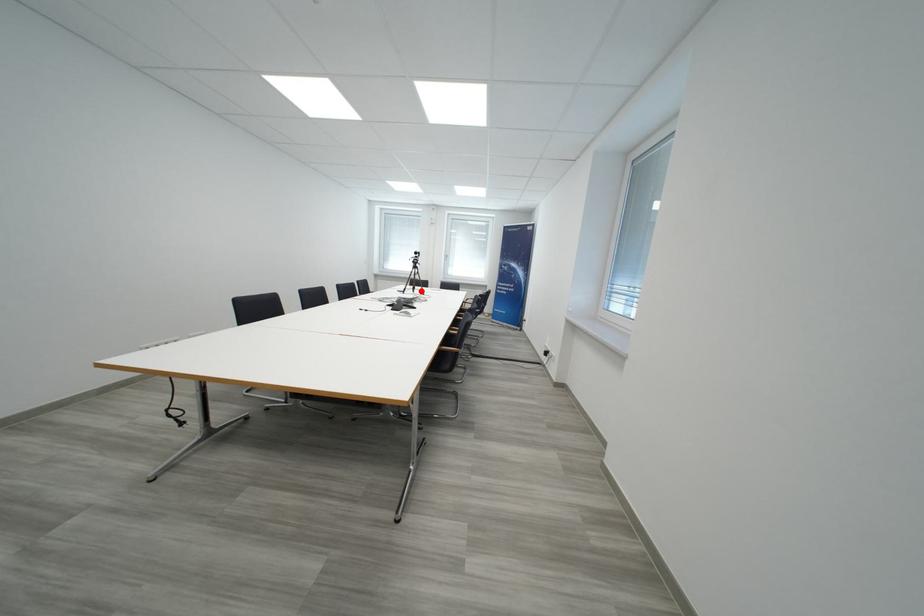
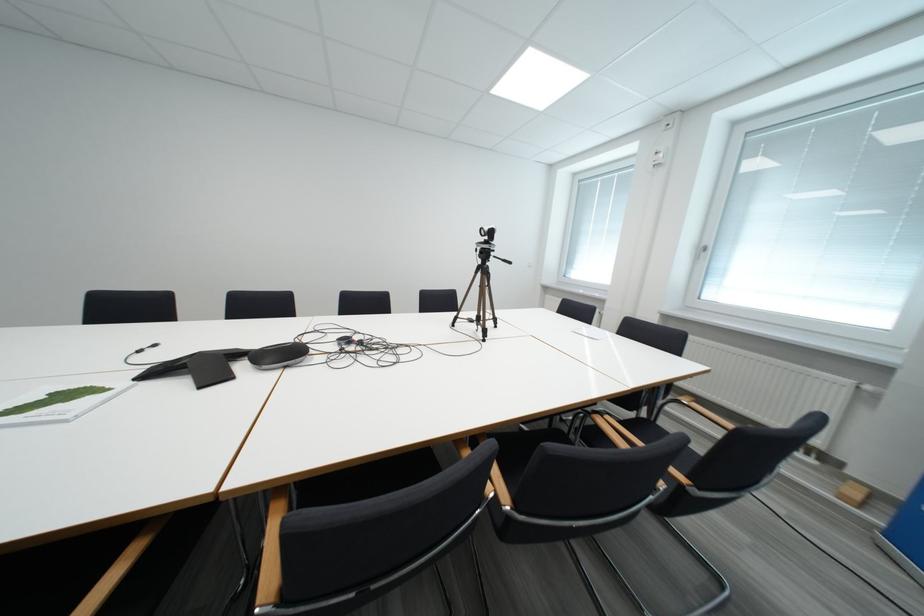
Question: I am providing you with two images of the same scene from different viewpoints. A red point is marked on the first image. Is the red point's position out of view in image 2?

Choices:
 (A) Yes
 (B) No

Answer: (B)